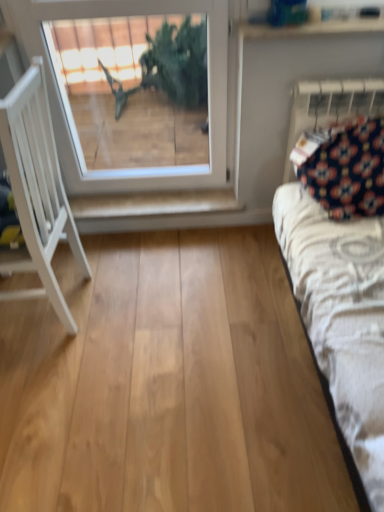
Question: From the image's perspective, is white wood chair at left located above or below dark blue fabric at upper right?

Choices:
 (A) below
 (B) above

Answer: (A)

Question: From a real-world perspective, is white wood chair at left positioned above or below dark blue fabric at upper right?

Choices:
 (A) below
 (B) above

Answer: (A)

Question: Estimate the real-world distances between objects in this image. Which object is closer to the white glass window at upper center?

Choices:
 (A) white wood chair at left
 (B) dark blue fabric at upper right
 (C) white painted wood shelf at center

Answer: (C)

Question: Estimate the real-world distances between objects in this image. Which object is closer to the white wood chair at left?

Choices:
 (A) white painted wood shelf at center
 (B) white glass window at upper center
 (C) dark blue fabric at upper right

Answer: (A)